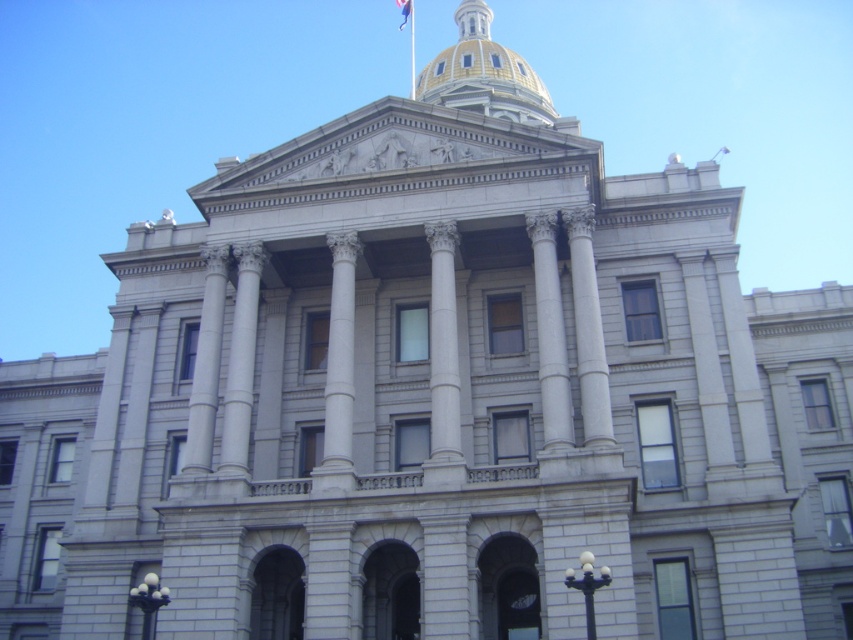
Question: Considering the relative positions of gold/golden dome at upper center and white fabric flag at upper center in the image provided, where is gold/golden dome at upper center located with respect to white fabric flag at upper center?

Choices:
 (A) right
 (B) left

Answer: (A)

Question: Which object appears farthest from the camera in this image?

Choices:
 (A) metallic flag pole at upper center
 (B) white fabric flag at upper center
 (C) gold/golden dome at upper center

Answer: (B)

Question: Can you confirm if metallic flag pole at upper center is positioned to the left of white fabric flag at upper center?

Choices:
 (A) yes
 (B) no

Answer: (B)

Question: Which object is positioned farthest from the metallic flag pole at upper center?

Choices:
 (A) white fabric flag at upper center
 (B) gold/golden dome at upper center

Answer: (B)

Question: Is gold/golden dome at upper center smaller than metallic flag pole at upper center?

Choices:
 (A) yes
 (B) no

Answer: (B)

Question: Which point is closer to the camera taking this photo?

Choices:
 (A) (410, 42)
 (B) (404, 22)
 (C) (521, 113)

Answer: (C)